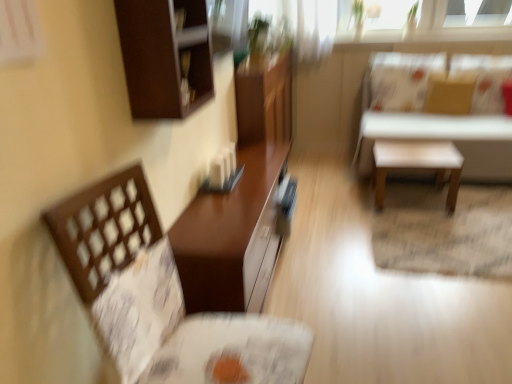
Question: From the image's perspective, is dark brown wood cabinet at upper left over matte brown table at center, which is the first table from left to right?

Choices:
 (A) yes
 (B) no

Answer: (A)

Question: From the image's perspective, is dark brown wood cabinet at upper left below matte brown table at center, which is the first table from left to right?

Choices:
 (A) yes
 (B) no

Answer: (B)

Question: Is dark brown wood cabinet at upper left far away from matte brown table at center, the 2th table positioned from the back?

Choices:
 (A) no
 (B) yes

Answer: (A)

Question: Is dark brown wood cabinet at upper left bigger than matte brown table at center, placed as the second table when sorted from right to left?

Choices:
 (A) yes
 (B) no

Answer: (B)

Question: Is dark brown wood cabinet at upper left facing away from matte brown table at center, which is the first table from left to right?

Choices:
 (A) yes
 (B) no

Answer: (B)

Question: Is white matte stool at upper right, acting as the second table starting from the left, taller or shorter than dark brown wood cabinet at upper left?

Choices:
 (A) short
 (B) tall

Answer: (B)

Question: Is white matte stool at upper right, which is the second table from front to back, in front of or behind dark brown wood cabinet at upper left in the image?

Choices:
 (A) behind
 (B) front

Answer: (A)

Question: From a real-world perspective, is white matte stool at upper right, the first table positioned from the back, positioned above or below dark brown wood cabinet at upper left?

Choices:
 (A) below
 (B) above

Answer: (A)

Question: From the image's perspective, relative to dark brown wood cabinet at upper left, is white matte stool at upper right, the first table positioned from the back, above or below?

Choices:
 (A) below
 (B) above

Answer: (B)

Question: Choose the correct answer: Is matte brown table at center, placed as the second table when sorted from right to left, inside dark brown wood cabinet at upper left or outside it?

Choices:
 (A) inside
 (B) outside

Answer: (B)

Question: Considering the positions of point (254, 196) and point (130, 52), is point (254, 196) closer or farther from the camera than point (130, 52)?

Choices:
 (A) farther
 (B) closer

Answer: (A)

Question: In terms of height, does matte brown table at center, the 2th table positioned from the back, look taller or shorter compared to dark brown wood cabinet at upper left?

Choices:
 (A) short
 (B) tall

Answer: (B)

Question: Is matte brown table at center, which is the first table from left to right, in front of or behind dark brown wood cabinet at upper left in the image?

Choices:
 (A) front
 (B) behind

Answer: (B)

Question: Do you think matte brown table at center, placed as the second table when sorted from right to left, is within white matte stool at center, or outside of it?

Choices:
 (A) inside
 (B) outside

Answer: (B)

Question: Would you say matte brown table at center, the 2th table positioned from the back, is to the left or to the right of white matte stool at center in the picture?

Choices:
 (A) left
 (B) right

Answer: (A)